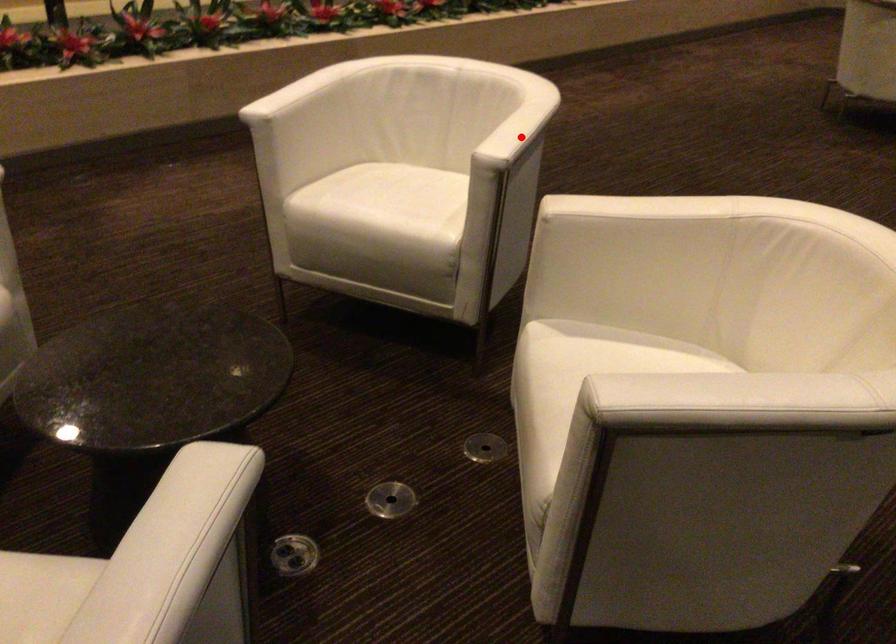
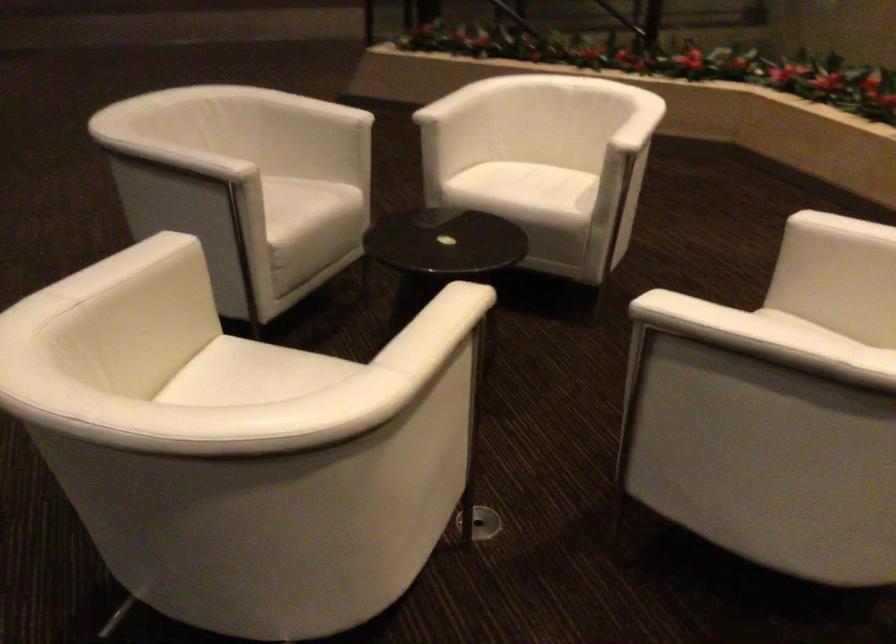
In the second image, find the point that corresponds to the highlighted location in the first image.

(694, 317)